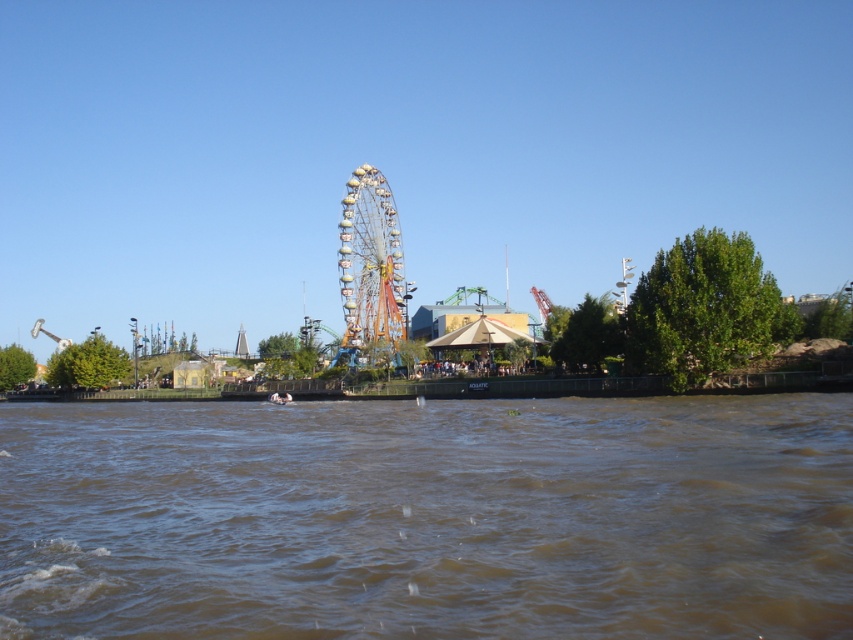
Can you confirm if brown muddy water at lower center is wider than metallic ferris wheel at center?

In fact, brown muddy water at lower center might be narrower than metallic ferris wheel at center.

Can you confirm if brown muddy water at lower center is taller than metallic ferris wheel at center?

No, brown muddy water at lower center is not taller than metallic ferris wheel at center.

Identify the location of brown muddy water at lower center. Image resolution: width=853 pixels, height=640 pixels. (428, 518).

The image size is (853, 640). What are the coordinates of `brown muddy water at lower center` in the screenshot? It's located at (428, 518).

Between brown muddy water at lower center and multicolored metallic ferris wheel at center, which one has less height?

brown muddy water at lower center is shorter.

Is brown muddy water at lower center wider than multicolored metallic ferris wheel at center?

Correct, the width of brown muddy water at lower center exceeds that of multicolored metallic ferris wheel at center.

Who is more forward, (229, 529) or (368, 200)?

Point (229, 529) is in front.

Where is `brown muddy water at lower center`? brown muddy water at lower center is located at coordinates (428, 518).

Image resolution: width=853 pixels, height=640 pixels. What do you see at coordinates (723, 314) in the screenshot?
I see `metallic ferris wheel at center` at bounding box center [723, 314].

Is metallic ferris wheel at center positioned behind multicolored metallic ferris wheel at center?

No, it is not.

Is point (172, 384) positioned behind point (363, 252)?

No, (172, 384) is in front of (363, 252).

Where is `metallic ferris wheel at center`? Image resolution: width=853 pixels, height=640 pixels. metallic ferris wheel at center is located at coordinates (723, 314).